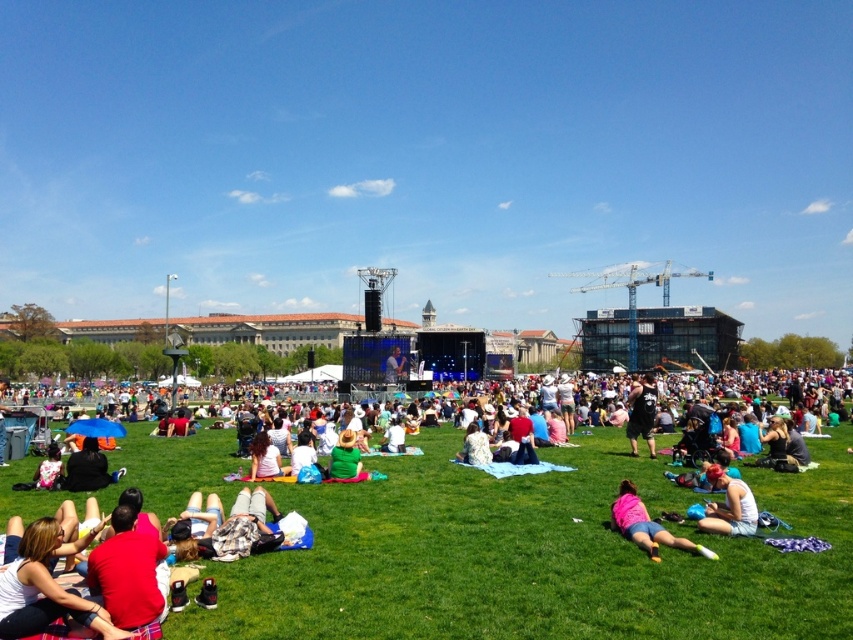
Question: Which point is farther from the camera taking this photo?

Choices:
 (A) (33, 602)
 (B) (639, 516)
 (C) (732, 497)

Answer: (B)

Question: Which point is farther to the camera?

Choices:
 (A) (93, 550)
 (B) (753, 516)
 (C) (259, 433)
 (D) (633, 529)

Answer: (C)

Question: Does white cotton tank top at lower right have a greater width compared to white cotton shirt at center?

Choices:
 (A) yes
 (B) no

Answer: (A)

Question: Which point is closer to the camera taking this photo?

Choices:
 (A) (80, 618)
 (B) (339, 451)
 (C) (740, 502)

Answer: (A)

Question: Is black cotton shirt at center above white cotton shirt at center?

Choices:
 (A) yes
 (B) no

Answer: (A)

Question: Observing the image, what is the correct spatial positioning of pink fabric shorts at lower right in reference to white cotton shirt at center?

Choices:
 (A) below
 (B) above

Answer: (A)